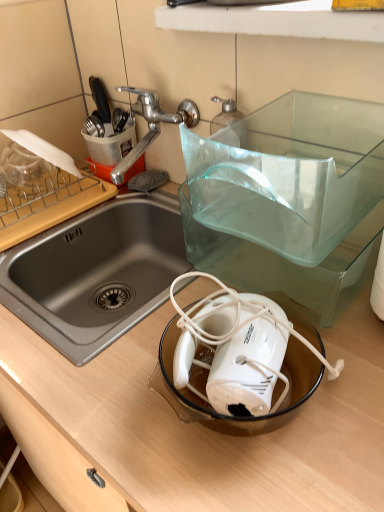
At what (x,y) coordinates should I click in order to perform the action: click on free space in front of white plastic mixer at center. Please return your answer as a coordinate pair (x, y). The image size is (384, 512). Looking at the image, I should click on (248, 475).